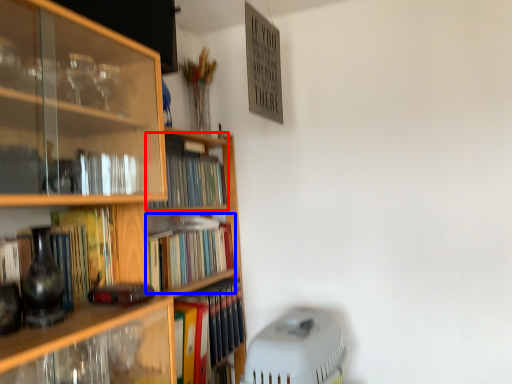
Question: Which of the following is the farthest to the observer, book (highlighted by a red box) or book (highlighted by a blue box)?

Choices:
 (A) book
 (B) book

Answer: (A)